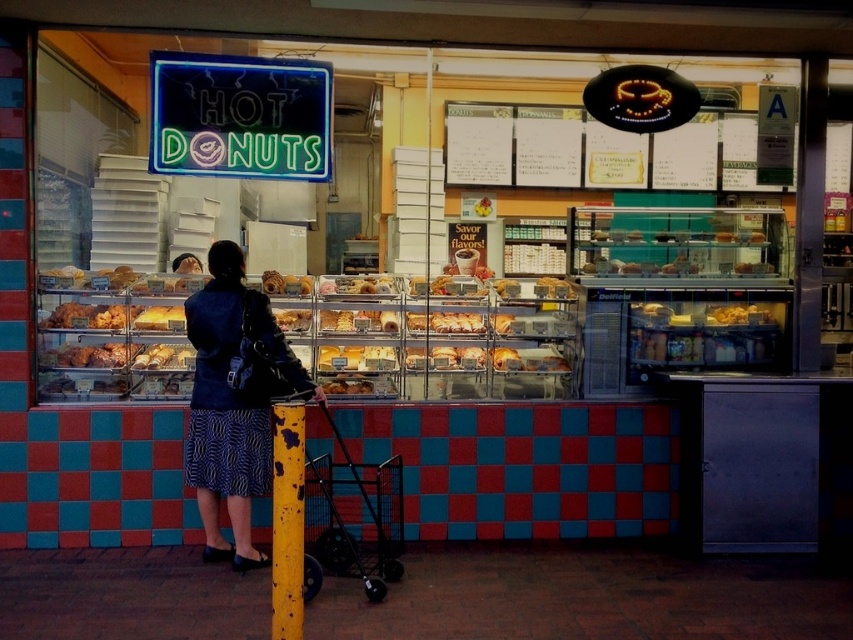
Who is higher up, yellow painted metal pole at center or yellow glazed pastry at center?

yellow glazed pastry at center is higher up.

Does yellow painted metal pole at center have a lesser width compared to yellow glazed pastry at center?

Yes, yellow painted metal pole at center is thinner than yellow glazed pastry at center.

Where is `yellow painted metal pole at center`? The height and width of the screenshot is (640, 853). yellow painted metal pole at center is located at coordinates (287, 518).

Between denim jacket at center and yellow glazed pastry at center, which one is positioned higher?

yellow glazed pastry at center is above.

Is denim jacket at center further to camera compared to yellow glazed pastry at center?

No.

Which is in front, point (264, 412) or point (148, 308)?

Point (264, 412) is in front.

This screenshot has width=853, height=640. In order to click on denim jacket at center in this screenshot , I will do `click(234, 401)`.

Between point (384, 541) and point (300, 524), which one is positioned in front?

Point (300, 524) is in front.

Is black metal baby carriage at lower center below yellow painted metal pole at center?

Correct, black metal baby carriage at lower center is located below yellow painted metal pole at center.

Between point (328, 460) and point (274, 577), which one is positioned behind?

The point (328, 460) is more distant.

Locate an element on the screen. Image resolution: width=853 pixels, height=640 pixels. black metal baby carriage at lower center is located at coordinates (344, 524).